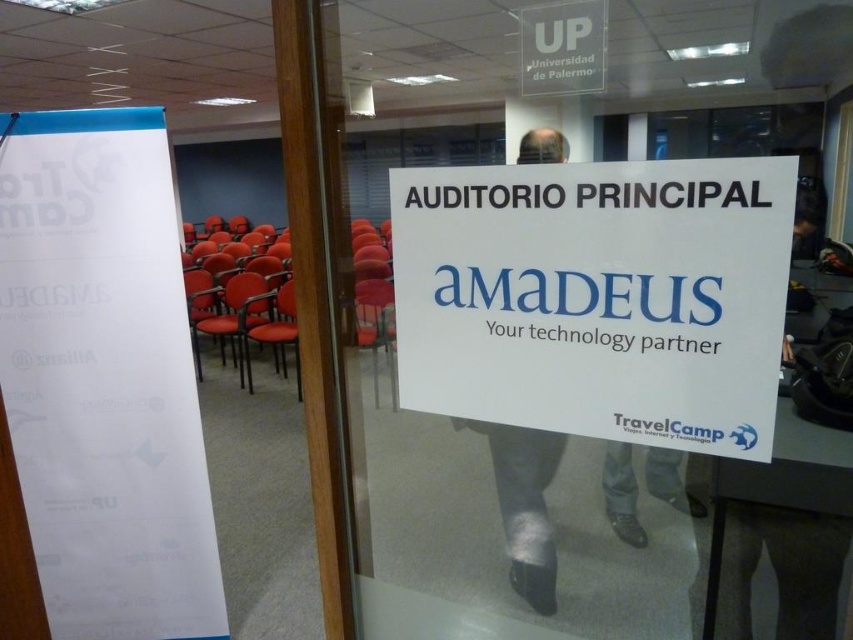
Question: Where is white paper sign at center located in relation to matte orange chair at center in the image?

Choices:
 (A) left
 (B) right

Answer: (B)

Question: Does transparent glass door at upper center appear under white paper at left?

Choices:
 (A) no
 (B) yes

Answer: (B)

Question: Among these points, which one is nearest to the camera?

Choices:
 (A) (766, 596)
 (B) (196, 396)
 (C) (715, 412)

Answer: (C)

Question: Is transparent glass door at upper center to the left of matte orange chair at center from the viewer's perspective?

Choices:
 (A) no
 (B) yes

Answer: (A)

Question: Which point is farther to the camera?

Choices:
 (A) matte orange chair at center
 (B) white paper at left

Answer: (A)

Question: Which object appears closest to the camera in this image?

Choices:
 (A) white paper at left
 (B) transparent glass door at upper center
 (C) matte orange chair at center
 (D) white paper sign at center

Answer: (D)